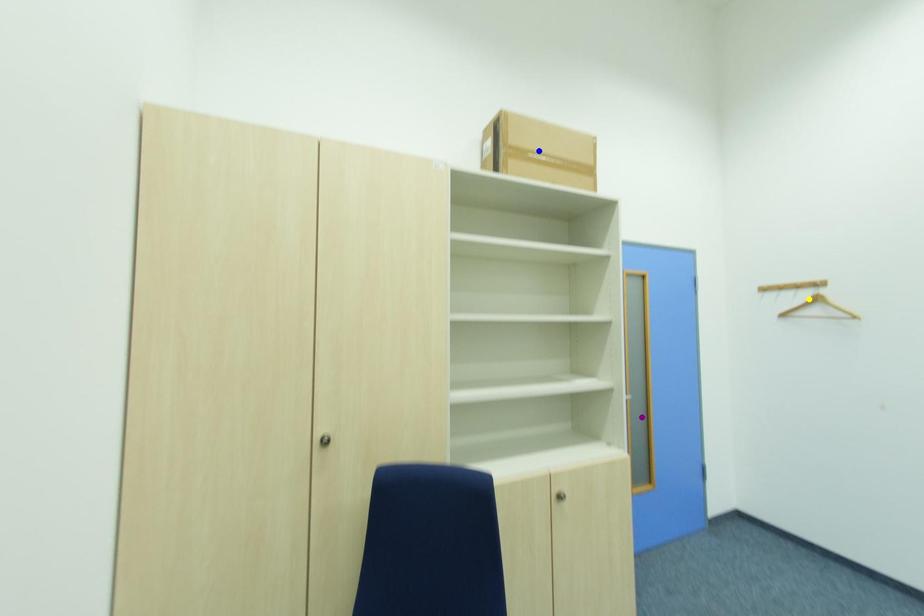
Order these from nearest to farthest:
1. yellow point
2. blue point
3. purple point

yellow point
purple point
blue point